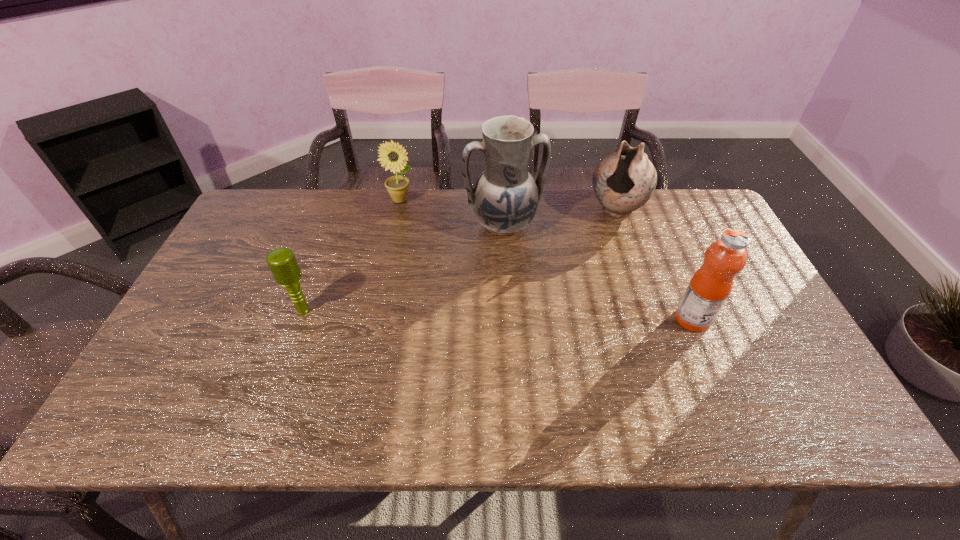
The image size is (960, 540). I want to click on unoccupied position between the pottery and the fruit juice, so click(x=655, y=265).

The height and width of the screenshot is (540, 960). I want to click on empty location between the fruit juice and the pitcher, so click(598, 272).

Identify the location of free space between the pitcher and the sunflower. (452, 212).

I want to click on vacant area that lies between the microphone and the fruit juice, so click(498, 315).

Image resolution: width=960 pixels, height=540 pixels. I want to click on free space between the sunflower and the fruit juice, so click(546, 260).

Locate an element on the screen. empty space that is in between the pottery and the tallest object is located at coordinates (560, 217).

At what (x,y) coordinates should I click in order to perform the action: click on vacant area that lies between the fruit juice and the third object from right to left. Please return your answer as a coordinate pair (x, y). This screenshot has height=540, width=960. Looking at the image, I should click on (598, 272).

Select which object appears as the third closest to the fruit juice. Please provide its 2D coordinates. Your answer should be formatted as a tuple, i.e. [(x, y)], where the tuple contains the x and y coordinates of a point satisfying the conditions above.

[(392, 156)]

Locate which object is the third closest to the tallest object. Please provide its 2D coordinates. Your answer should be formatted as a tuple, i.e. [(x, y)], where the tuple contains the x and y coordinates of a point satisfying the conditions above.

[(710, 286)]

Find the location of a particular element. The height and width of the screenshot is (540, 960). free space that satisfies the following two spatial constraints: 1. on the back side of the leftmost object; 2. on the left side of the second object from left to right is located at coordinates (344, 200).